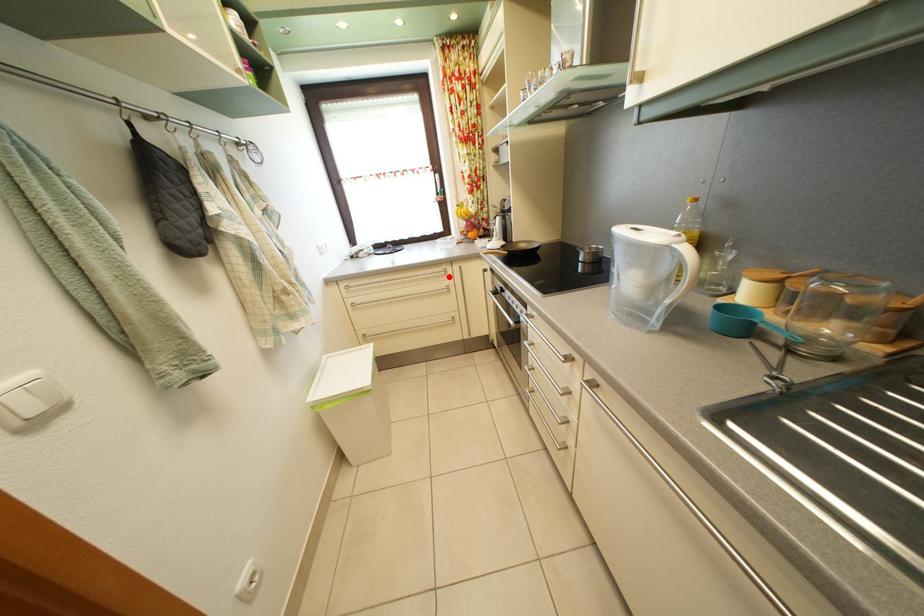
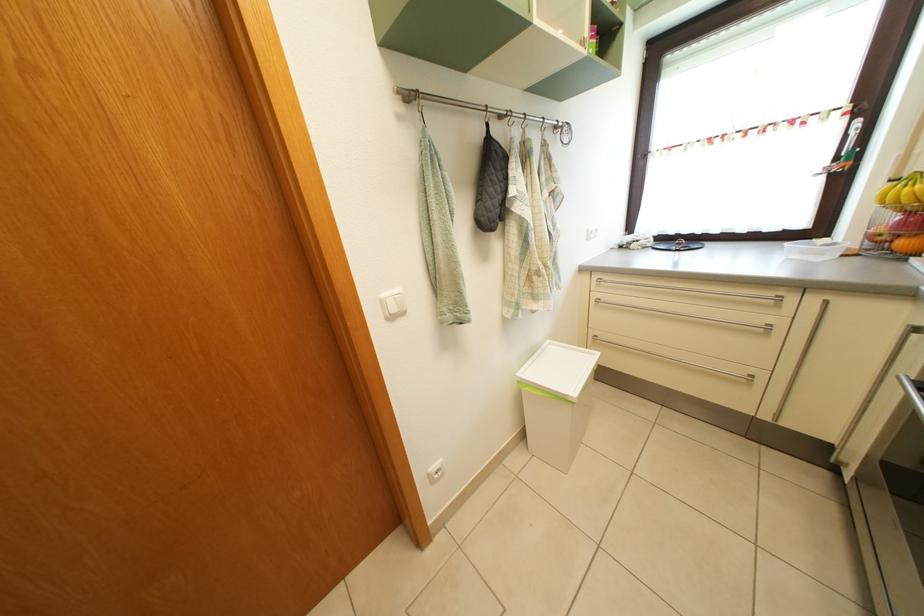
In the second image, find the point that corresponds to the highlighted location in the first image.

(776, 302)